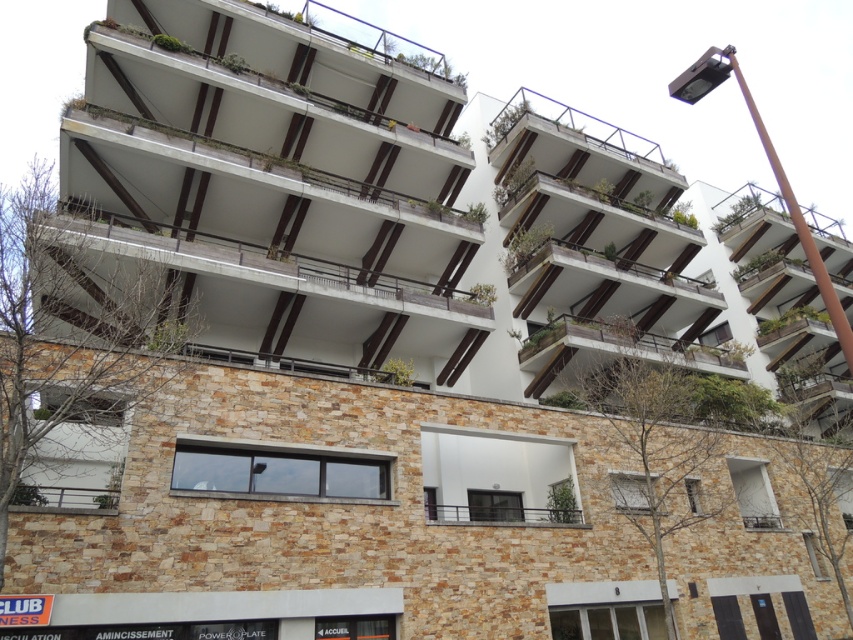
Question: Is white wooden balcony at center above green wooden balcony at upper center?

Choices:
 (A) no
 (B) yes

Answer: (A)

Question: Can you confirm if white concrete balcony at center is wider than white wooden balcony at center?

Choices:
 (A) yes
 (B) no

Answer: (B)

Question: Which of these objects is positioned closest to the white wooden balcony at center?

Choices:
 (A) concrete at center
 (B) brown stone balcony at center
 (C) green wooden balcony at upper center

Answer: (C)

Question: Which object is the farthest from the brown stone balcony at center?

Choices:
 (A) white wooden balcony at center
 (B) concrete at center

Answer: (B)

Question: Among these points, which one is farthest from the camera?

Choices:
 (A) pyautogui.click(x=512, y=205)
 (B) pyautogui.click(x=635, y=266)
 (C) pyautogui.click(x=183, y=35)
 (D) pyautogui.click(x=602, y=333)

Answer: (B)

Question: Can you confirm if white concrete balcony at center is bigger than white wooden balcony at center?

Choices:
 (A) no
 (B) yes

Answer: (A)